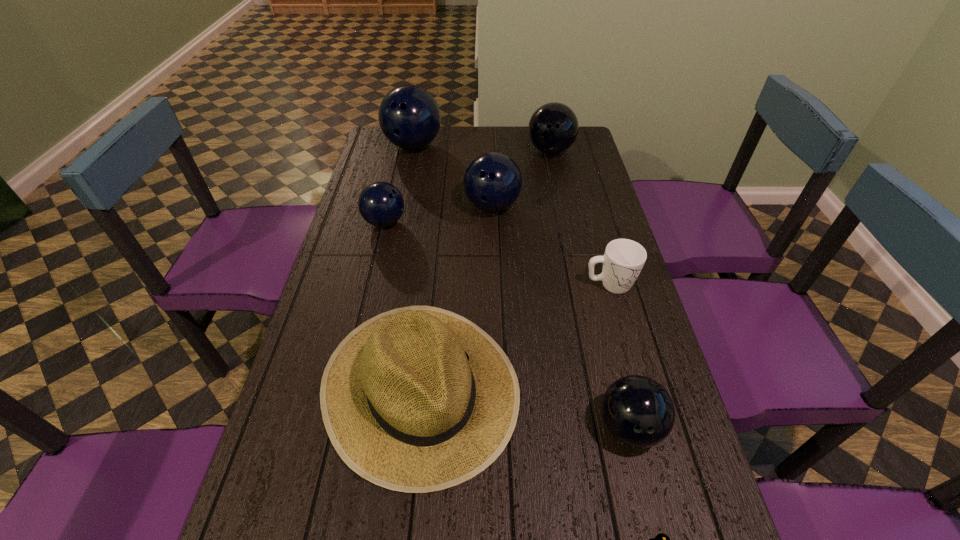
Image resolution: width=960 pixels, height=540 pixels. What are the coordinates of `vacant space in between the biggest blue bowling ball and the nearer black bowling ball` in the screenshot? It's located at (521, 286).

Select which object is the seventh closest to the tallest object. Please provide its 2D coordinates. Your answer should be formatted as a tuple, i.e. [(x, y)], where the tuple contains the x and y coordinates of a point satisfying the conditions above.

[(661, 539)]

Locate an element on the screen. the third closest object to the bigger black bowling ball is located at coordinates pos(381,204).

At what (x,y) coordinates should I click in order to perform the action: click on bowling ball that is the fifth closest to the black sunhat. Please return your answer as a coordinate pair (x, y). Looking at the image, I should click on (409, 117).

Identify which bowling ball is the second nearest to the mug. Please provide its 2D coordinates. Your answer should be formatted as a tuple, i.e. [(x, y)], where the tuple contains the x and y coordinates of a point satisfying the conditions above.

[(638, 411)]

Point out which blue bowling ball is positioned as the nearest to the smallest blue bowling ball. Please provide its 2D coordinates. Your answer should be formatted as a tuple, i.e. [(x, y)], where the tuple contains the x and y coordinates of a point satisfying the conditions above.

[(492, 182)]

Where is `the third closest blue bowling ball to the sunhat`? the third closest blue bowling ball to the sunhat is located at coordinates (409, 117).

Where is `free space that satisfies the following two spatial constraints: 1. on the surface of the black sunhat near the finger holes; 2. on the left side of the tallest bowling ball`? free space that satisfies the following two spatial constraints: 1. on the surface of the black sunhat near the finger holes; 2. on the left side of the tallest bowling ball is located at coordinates (364, 387).

The height and width of the screenshot is (540, 960). Find the location of `vacant space that satisfies the following two spatial constraints: 1. on the surface of the farthest blue bowling ball near the finger holes; 2. on the surface of the smallest blue bowling ball near the finger holes`. vacant space that satisfies the following two spatial constraints: 1. on the surface of the farthest blue bowling ball near the finger holes; 2. on the surface of the smallest blue bowling ball near the finger holes is located at coordinates coord(397,222).